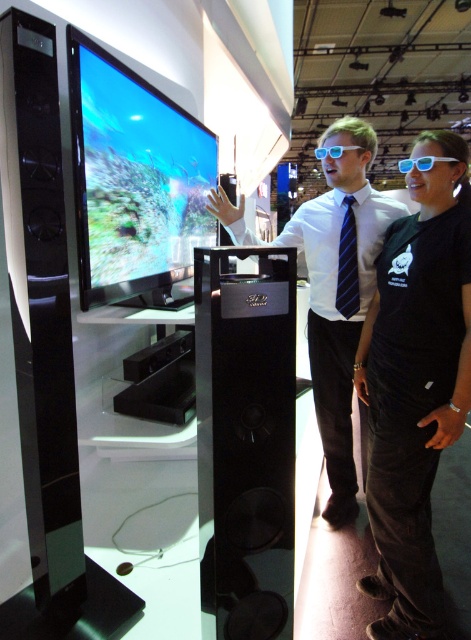
Can you confirm if shiny glossy screen at center is shorter than blue striped tie at center?

No, shiny glossy screen at center is not shorter than blue striped tie at center.

Measure the distance between shiny glossy screen at center and camera.

shiny glossy screen at center and camera are 1.29 meters apart from each other.

This screenshot has width=471, height=640. I want to click on shiny glossy screen at center, so click(x=134, y=179).

Does point (420, 614) lie behind point (123, 260)?

Yes, it is.

Does black corduroy pants at lower right come in front of shiny glossy screen at center?

No, it is behind shiny glossy screen at center.

What do you see at coordinates (415, 384) in the screenshot? Image resolution: width=471 pixels, height=640 pixels. I see `black corduroy pants at lower right` at bounding box center [415, 384].

Find the location of a particular element. black corduroy pants at lower right is located at coordinates (415, 384).

Which is in front, point (347, 234) or point (355, 147)?

Positioned in front is point (355, 147).

What do you see at coordinates (348, 264) in the screenshot?
I see `blue striped tie at center` at bounding box center [348, 264].

Is point (347, 252) farther from camera compared to point (355, 147)?

That is True.

Identify the location of blue striped tie at center. This screenshot has height=640, width=471. (348, 264).